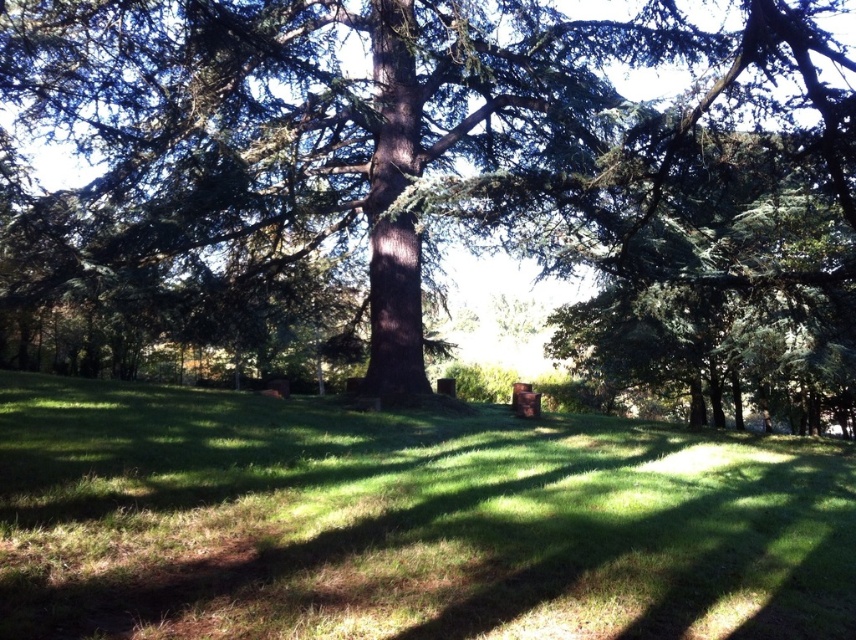
Image resolution: width=856 pixels, height=640 pixels. Identify the location of green textured tree at center. (444, 179).

Can you confirm if green textured tree at center is shorter than green grassy at center?

In fact, green textured tree at center may be taller than green grassy at center.

At what (x,y) coordinates should I click in order to perform the action: click on green textured tree at center. Please return your answer as a coordinate pair (x, y). This screenshot has width=856, height=640. Looking at the image, I should click on (444, 179).

I want to click on green textured tree at center, so click(444, 179).